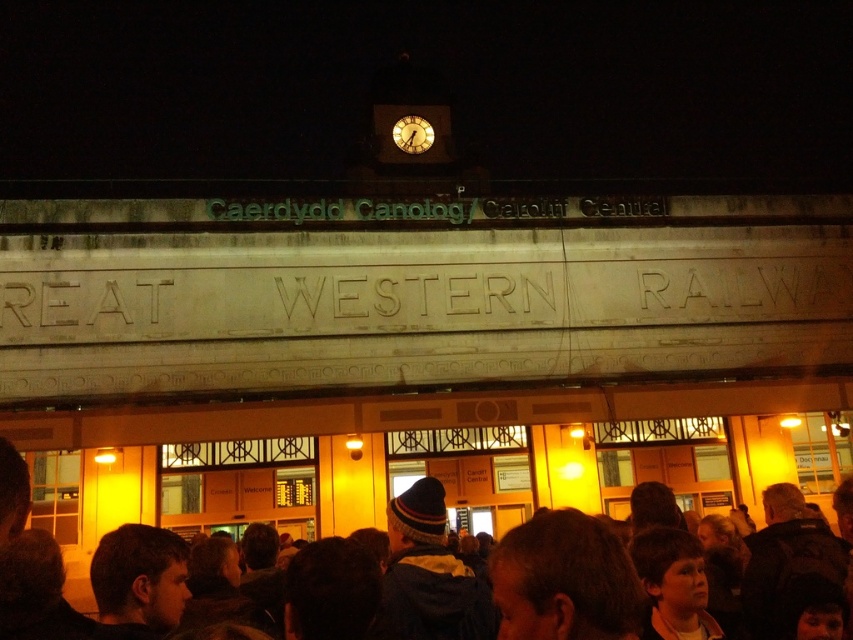
Does brown woolen hat at center have a lesser width compared to matte white clock at center?

In fact, brown woolen hat at center might be wider than matte white clock at center.

Locate an element on the screen. Image resolution: width=853 pixels, height=640 pixels. brown woolen hat at center is located at coordinates pos(572,582).